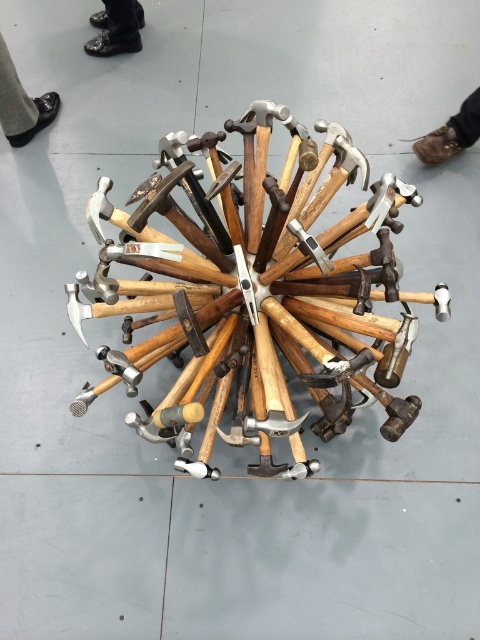
Consider the image. Who is more distant from viewer, [0,99] or [466,120]?

Point [0,99]

Find the location of a particular element. black leather shoe at upper left is located at coordinates (22, 104).

In the scene shown: Does black leather shoe at upper left have a smaller size compared to shiny leather shoes at upper left?

No, black leather shoe at upper left is not smaller than shiny leather shoes at upper left.

How far apart are black leather shoe at upper left and shiny leather shoes at upper left?

The distance of black leather shoe at upper left from shiny leather shoes at upper left is 14.77 inches.

Is point (0, 99) in front of point (93, 44)?

That is True.

Where is `black leather shoe at upper left`? black leather shoe at upper left is located at coordinates (22, 104).

Does wooden hammer at center come in front of shiny leather shoes at upper left?

Yes, it is in front of shiny leather shoes at upper left.

Can you confirm if wooden hammer at center is wider than shiny leather shoes at upper left?

Yes.

Is point (377, 182) behind point (130, 8)?

No, (377, 182) is in front of (130, 8).

This screenshot has height=640, width=480. I want to click on wooden hammer at center, so click(x=264, y=296).